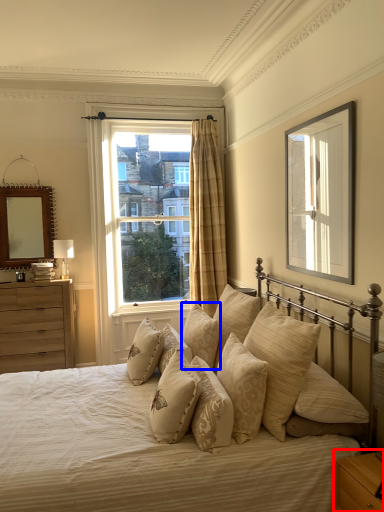
Question: Among these objects, which one is farthest to the camera, nightstand (highlighted by a red box) or pillow (highlighted by a blue box)?

Choices:
 (A) nightstand
 (B) pillow

Answer: (B)